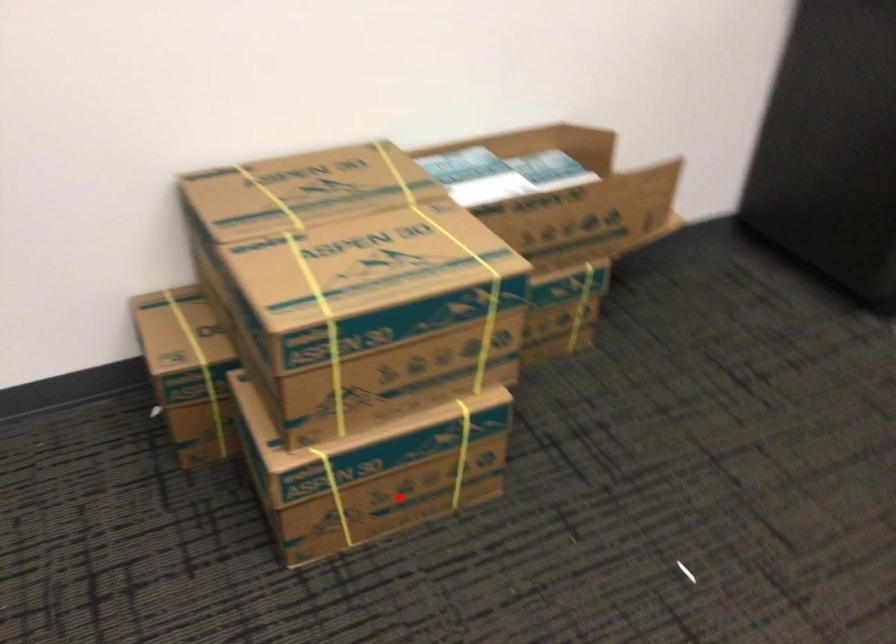
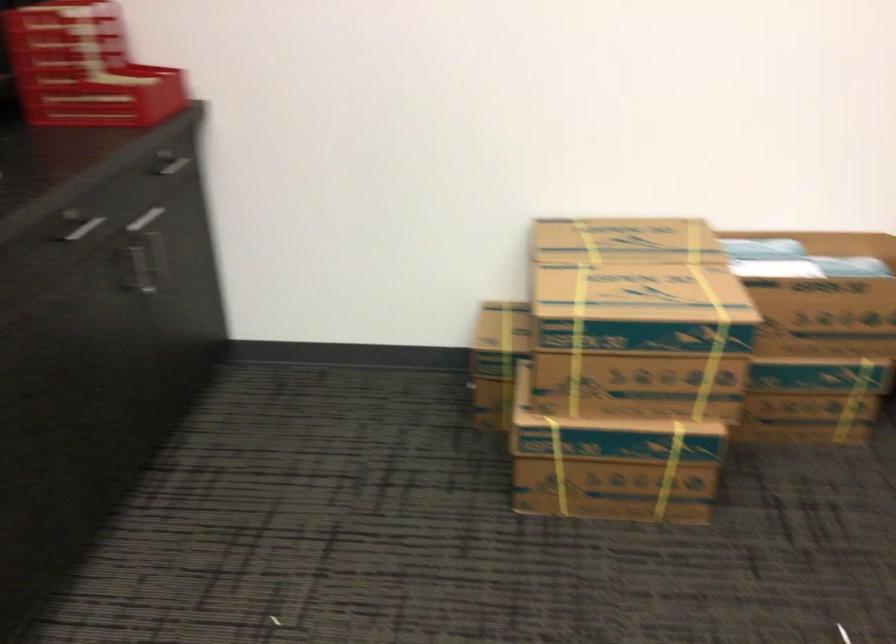
Question: A red point is marked in image1. In image2, is the corresponding 3D point closer to the camera or farther? Reply with the corresponding letter.

Choices:
 (A) The corresponding 3D point is closer.
 (B) The corresponding 3D point is farther.

Answer: (B)